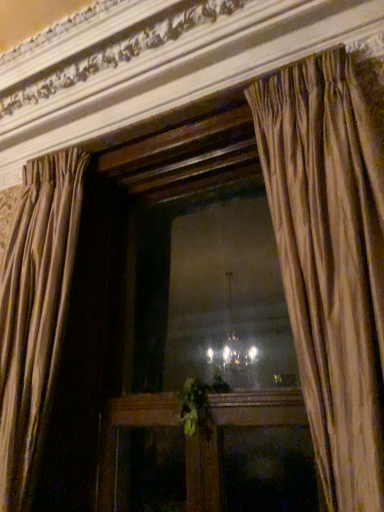
Question: Does silky beige curtain at center, the first curtain when ordered from right to left, have a greater width compared to wooden frame at center?

Choices:
 (A) yes
 (B) no

Answer: (A)

Question: Does silky beige curtain at center, the first curtain when ordered from right to left, come in front of wooden frame at center?

Choices:
 (A) no
 (B) yes

Answer: (B)

Question: Considering the relative sizes of silky beige curtain at center, the first curtain when ordered from right to left, and wooden frame at center in the image provided, is silky beige curtain at center, the first curtain when ordered from right to left, bigger than wooden frame at center?

Choices:
 (A) no
 (B) yes

Answer: (B)

Question: Is silky beige curtain at center, which is the 2th curtain in left-to-right order, oriented towards wooden frame at center?

Choices:
 (A) no
 (B) yes

Answer: (A)

Question: From a real-world perspective, is silky beige curtain at center, which is the 2th curtain in left-to-right order, on wooden frame at center?

Choices:
 (A) no
 (B) yes

Answer: (B)

Question: From the image's perspective, would you say silky beige curtain at center, which is the 2th curtain in left-to-right order, is positioned over wooden frame at center?

Choices:
 (A) yes
 (B) no

Answer: (A)

Question: Can you confirm if silky beige curtain at left, the first curtain viewed from the left, is positioned to the right of green leafy plant at center?

Choices:
 (A) yes
 (B) no

Answer: (B)

Question: From a real-world perspective, is silky beige curtain at left, the first curtain viewed from the left, positioned over green leafy plant at center based on gravity?

Choices:
 (A) yes
 (B) no

Answer: (A)

Question: Is silky beige curtain at left, the first curtain viewed from the left, wider than green leafy plant at center?

Choices:
 (A) no
 (B) yes

Answer: (B)

Question: Is silky beige curtain at left, the first curtain viewed from the left, smaller than green leafy plant at center?

Choices:
 (A) yes
 (B) no

Answer: (B)

Question: Is silky beige curtain at left, the second curtain from the right, shorter than green leafy plant at center?

Choices:
 (A) yes
 (B) no

Answer: (B)

Question: Can you confirm if silky beige curtain at left, the second curtain from the right, is thinner than green leafy plant at center?

Choices:
 (A) no
 (B) yes

Answer: (A)

Question: Is wooden frame at center not near silky beige curtain at center, which is the 2th curtain in left-to-right order?

Choices:
 (A) yes
 (B) no

Answer: (B)